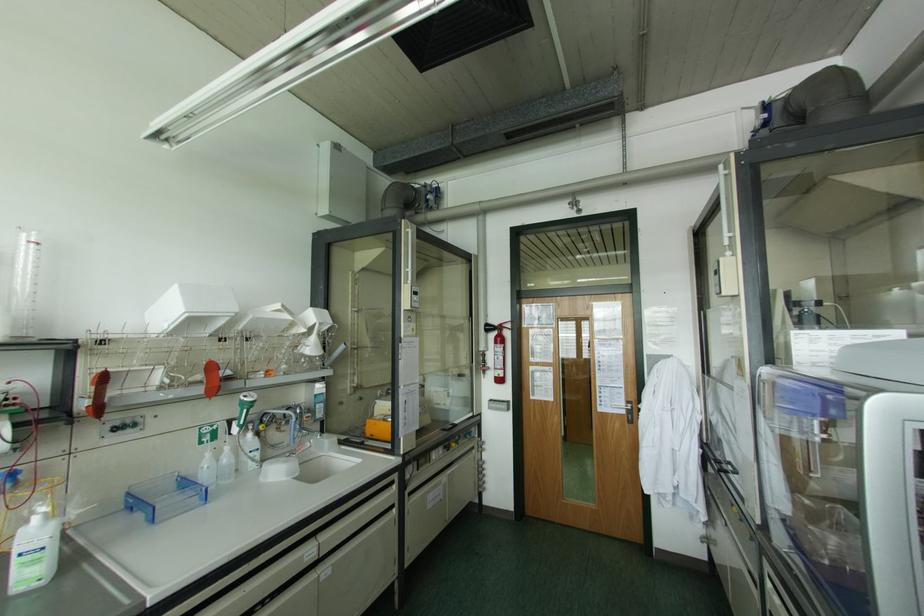
Find where to squeez the fire extinguisher handle. Please return your answer as a coordinate pair (x, y).

(496, 326)